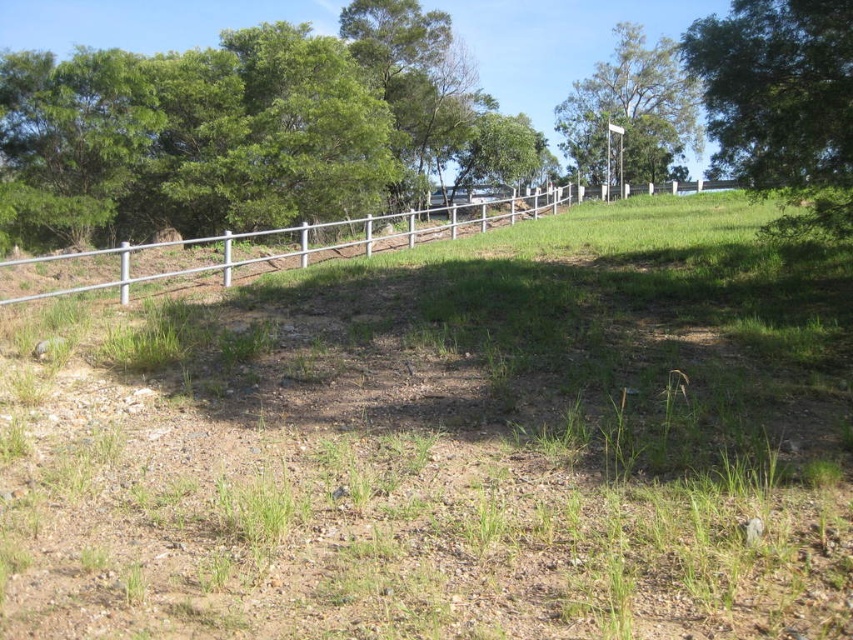
Describe the element at coordinates (781, 104) in the screenshot. Image resolution: width=853 pixels, height=640 pixels. I see `green leafy tree at upper right` at that location.

At what (x,y) coordinates should I click in order to perform the action: click on green leafy tree at upper right. Please return your answer as a coordinate pair (x, y). This screenshot has height=640, width=853. Looking at the image, I should click on (781, 104).

Can you confirm if green leafy tree at upper right is positioned above green leafy tree at upper center?

Incorrect, green leafy tree at upper right is not positioned above green leafy tree at upper center.

Who is positioned more to the left, green leafy tree at upper right or green leafy tree at upper center?

green leafy tree at upper center is more to the left.

Does point (764, 163) lie behind point (660, 74)?

That is False.

The image size is (853, 640). In order to click on green leafy tree at upper right in this screenshot , I will do `click(781, 104)`.

Which is more to the left, silver metallic fence at upper center or green leafy tree at upper center?

silver metallic fence at upper center

Who is more forward, (186, 264) or (596, 97)?

Point (186, 264) is more forward.

Find the location of a particular element. The image size is (853, 640). silver metallic fence at upper center is located at coordinates (264, 246).